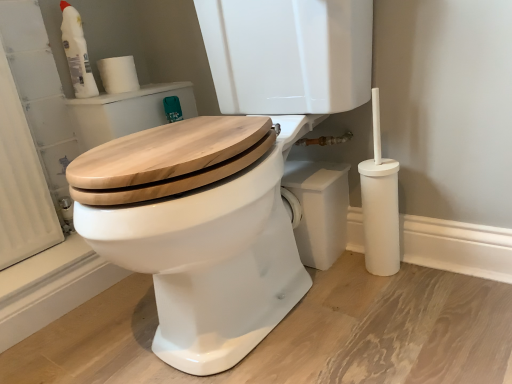
Question: From the image's perspective, does white plastic bottle at upper left appear lower than white matte toilet paper at upper left?

Choices:
 (A) yes
 (B) no

Answer: (B)

Question: Does white plastic bottle at upper left come in front of white matte toilet paper at upper left?

Choices:
 (A) yes
 (B) no

Answer: (A)

Question: From the image's perspective, does white plastic bottle at upper left appear higher than white matte toilet paper at upper left?

Choices:
 (A) yes
 (B) no

Answer: (A)

Question: Is the depth of white plastic bottle at upper left greater than that of white matte toilet paper at upper left?

Choices:
 (A) yes
 (B) no

Answer: (B)

Question: Is white matte toilet paper at upper left at the back of white plastic bottle at upper left?

Choices:
 (A) yes
 (B) no

Answer: (B)

Question: Considering the relative positions of wooden toilet seat at center and white plastic bottle at upper left in the image provided, is wooden toilet seat at center to the left or to the right of white plastic bottle at upper left?

Choices:
 (A) right
 (B) left

Answer: (A)

Question: From a real-world perspective, is wooden toilet seat at center above or below white plastic bottle at upper left?

Choices:
 (A) above
 (B) below

Answer: (B)

Question: Is wooden toilet seat at center taller or shorter than white plastic bottle at upper left?

Choices:
 (A) tall
 (B) short

Answer: (A)

Question: Is wooden toilet seat at center inside the boundaries of white plastic bottle at upper left, or outside?

Choices:
 (A) outside
 (B) inside

Answer: (A)

Question: Considering the positions of white matte toilet paper at upper left and white plastic bottle at upper left in the image, is white matte toilet paper at upper left bigger or smaller than white plastic bottle at upper left?

Choices:
 (A) big
 (B) small

Answer: (B)

Question: In the image, is white matte toilet paper at upper left positioned in front of or behind white plastic bottle at upper left?

Choices:
 (A) behind
 (B) front

Answer: (A)

Question: Is white matte toilet paper at upper left wider or thinner than white plastic bottle at upper left?

Choices:
 (A) wide
 (B) thin

Answer: (A)

Question: Is white matte toilet paper at upper left to the left or to the right of white plastic bottle at upper left in the image?

Choices:
 (A) left
 (B) right

Answer: (B)

Question: From the image's perspective, relative to wooden toilet seat at center, is white plastic bottle at upper left above or below?

Choices:
 (A) above
 (B) below

Answer: (A)

Question: From a real-world perspective, is white plastic bottle at upper left physically located above or below wooden toilet seat at center?

Choices:
 (A) above
 (B) below

Answer: (A)